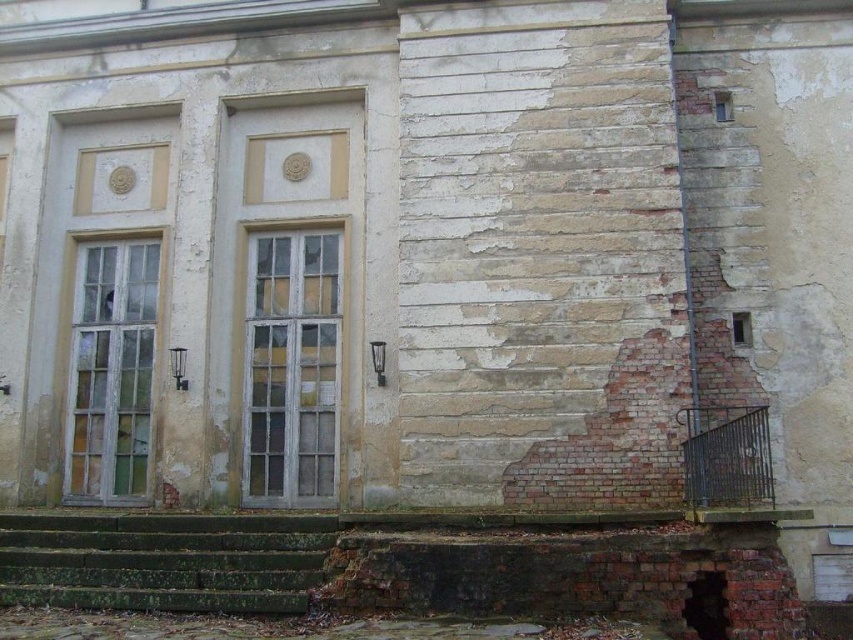
You are standing in front of the old building and want to enter through the double doors on the left. Are the green mossy stone stairs at lower left directly in front of the doors, or are they positioned to the side?

The green mossy stone stairs at lower left are located at point coordinates that place them to the side of the double doors rather than directly in front. Therefore, they are positioned to the side of the doors.

You are standing in front of the old building and notice two points marked on the facade. Which point, point (19,536) or point (248,388), is closer to you?

Point (19,536) is closer to the camera than point (248,388), so it is closer to you.